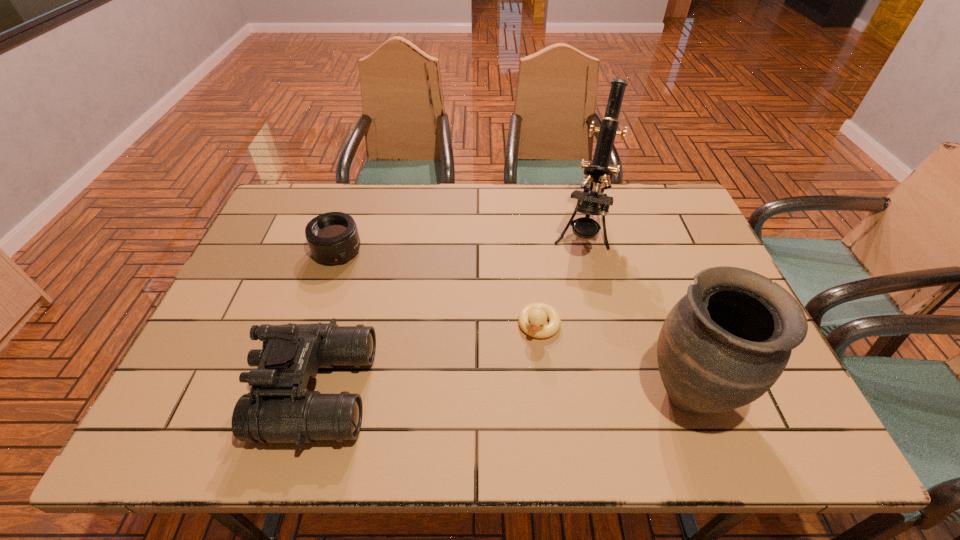
I want to click on vacant space that is in between the third object from left to right and the urn, so click(614, 359).

Identify the location of unoccupied position between the duckling and the second tallest object. (614, 359).

The width and height of the screenshot is (960, 540). Identify the location of unoccupied area between the microscope and the telephoto lens. (460, 241).

I want to click on vacant space that's between the microscope and the telephoto lens, so coord(460,241).

The height and width of the screenshot is (540, 960). Identify the location of vacant point located between the microscope and the duckling. (561, 279).

Where is `unoccupied position between the binoculars and the duckling`? unoccupied position between the binoculars and the duckling is located at coordinates (428, 358).

Locate an element on the screen. the second closest object to the binoculars is located at coordinates (532, 318).

You are a GUI agent. You are given a task and a screenshot of the screen. Output one action in this format:
    pyautogui.click(x=<x>, y=<y>)
    Task: Click on the object identified as the second closest to the telephoto lens
    This screenshot has height=540, width=960.
    Given the screenshot: What is the action you would take?
    pyautogui.click(x=532, y=318)

You are a GUI agent. You are given a task and a screenshot of the screen. Output one action in this format:
    pyautogui.click(x=<x>, y=<y>)
    Task: Click on the vacant region that satisfies the following two spatial constraints: 1. on the back side of the microscope; 2. on the right side of the third object from left to right
    The width and height of the screenshot is (960, 540).
    Given the screenshot: What is the action you would take?
    pyautogui.click(x=528, y=232)

Find the location of a particular element. free space that satisfies the following two spatial constraints: 1. on the front side of the tallest object; 2. on the left side of the urn is located at coordinates (621, 393).